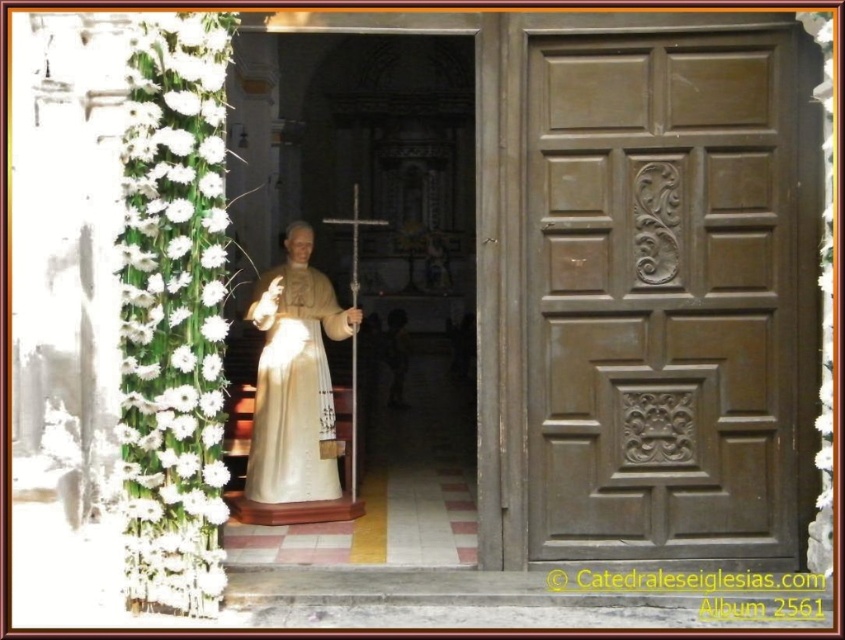
You are a photographer setting up equipment in the church entrance. You have a matte gold robe at center and a metallic silver crucifix at center in your viewfinder. Which object should you zoom in on to capture the taller subject?

The metallic silver crucifix at center is taller than the matte gold robe at center, so you should zoom in on the metallic silver crucifix at center to capture the taller subject.

Looking at this image, you are standing at the entrance of the church and see a point marked at coordinates (293, 387). What is located at this point?

The point at coordinates (293, 387) indicates the location of the matte gold robe at center.